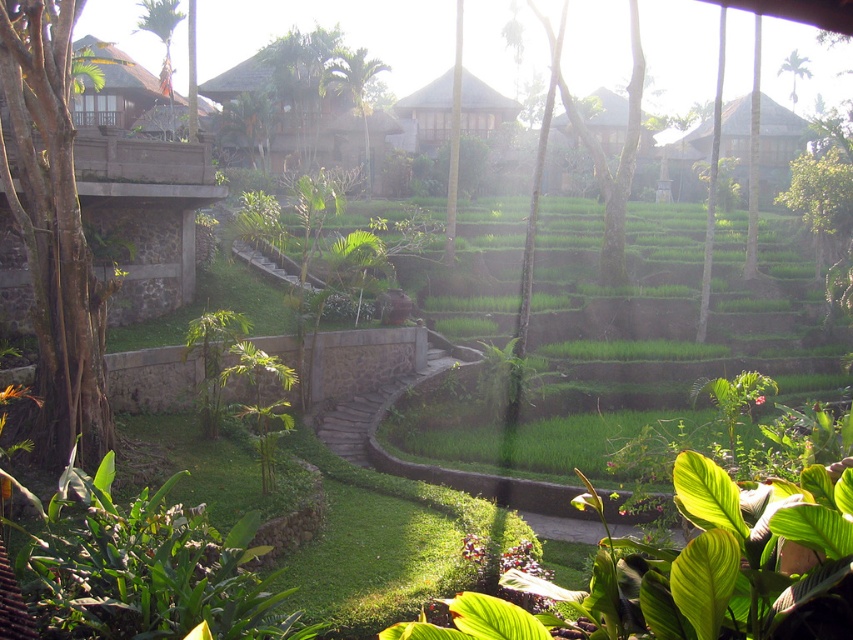
You are a photographer standing at the camera position. You want to capture a photo of the green leafy tree at upper left. Considering the distance between you and the tree, will you need to use a telephoto lens to ensure the tree appears large enough in the frame?

The green leafy tree at upper left and camera are 48.15 meters apart. To ensure the tree appears large enough in the frame from this distance, you would need to use a telephoto lens.

You are standing at the entrance of the resort and want to reach a specific point marked as point [73,168]. If you walk straight ahead, how far will you have to walk to reach that point?

The distance of point [73,168] from viewer is 49.17 feet, so you will have to walk 49.17 feet straight ahead to reach it.